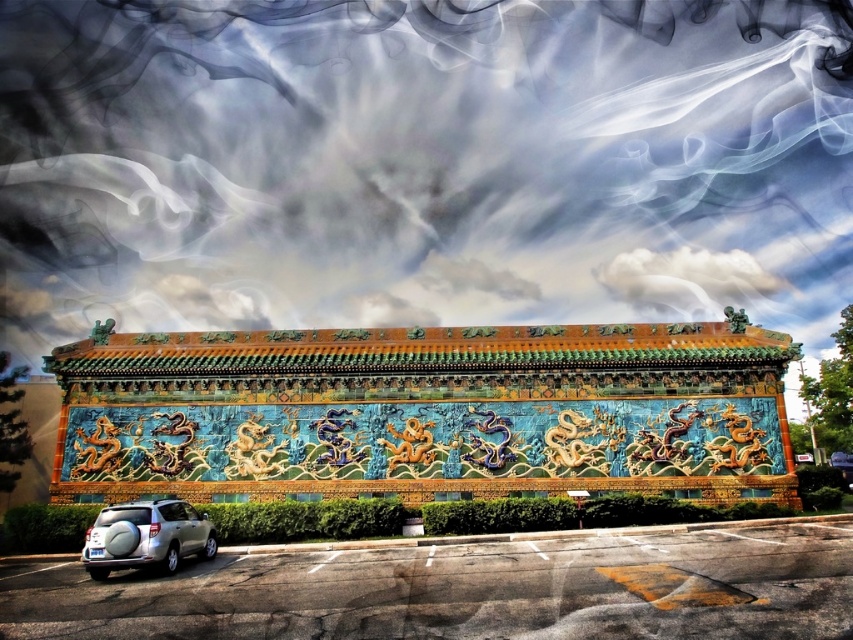
You are standing in front of the shiny ceramic wall at center and want to see the satin silver suv at lower left. In which direction should you turn your head?

The shiny ceramic wall at center is to the right of the satin silver suv at lower left, so you should turn your head to the left to see the satin silver suv at lower left.

You are a photographer standing in front of the shiny ceramic wall at center and the satin silver suv at lower left. You want to take a photo of the suv without the wall blocking it. Is the suv positioned in a way that allows you to capture it without the wall obstructing the view?

The satin silver suv at lower left is behind the shiny ceramic wall at center, so it is currently blocked by the wall. To capture the suv without obstruction, you would need to move around or behind the wall to get a clear view.